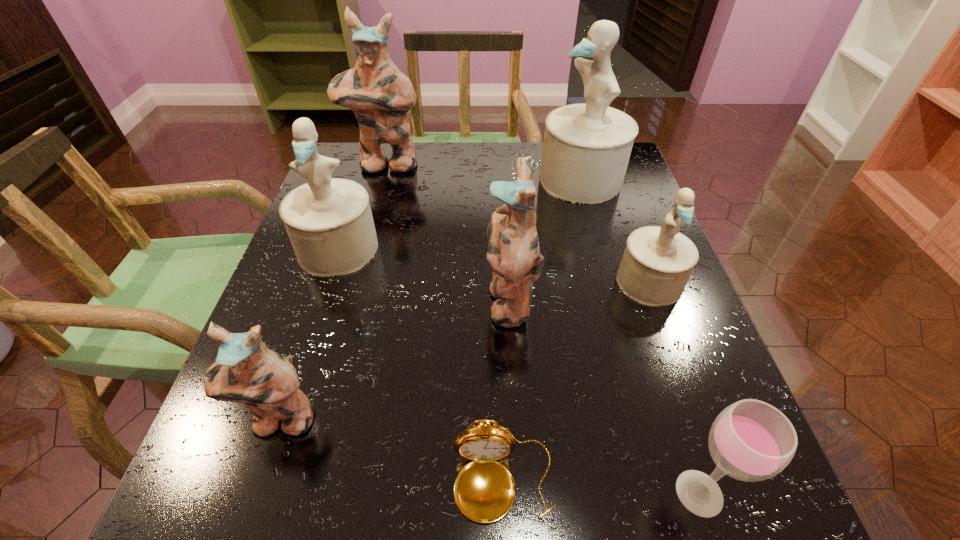
Where is `the closest pink figurine to the leftmost white figurine`? The image size is (960, 540). the closest pink figurine to the leftmost white figurine is located at coordinates (380, 95).

I want to click on vacant space that satisfies the following two spatial constraints: 1. on the front-facing side of the second biggest pink figurine; 2. on the face of the shortest object, so click(520, 482).

Locate an element on the screen. The width and height of the screenshot is (960, 540). free space that satisfies the following two spatial constraints: 1. on the face of the pocket watch; 2. on the right side of the wineglass is located at coordinates (504, 493).

The width and height of the screenshot is (960, 540). What are the coordinates of `free space that satisfies the following two spatial constraints: 1. on the back side of the wineglass; 2. at the beak of the farthest white figurine` in the screenshot? It's located at (597, 179).

I want to click on free space that satisfies the following two spatial constraints: 1. at the beak of the smallest white figurine; 2. on the front-facing side of the second farthest pink figurine, so click(x=656, y=300).